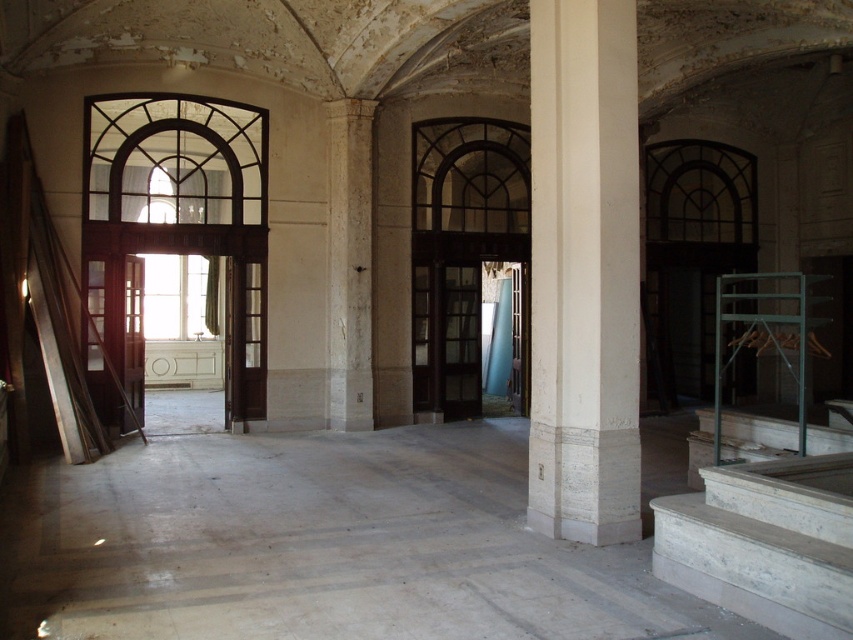
Question: Is white marble column at center bigger than white marble stairs at lower right?

Choices:
 (A) yes
 (B) no

Answer: (A)

Question: Can you confirm if white marble column at center is positioned to the left of white marble stairs at lower right?

Choices:
 (A) yes
 (B) no

Answer: (A)

Question: Which point is closer to the camera?

Choices:
 (A) white marble column at center
 (B) white marble stairs at lower right

Answer: (B)

Question: Can you confirm if white marble column at center is positioned to the left of white marble stairs at lower right?

Choices:
 (A) no
 (B) yes

Answer: (B)